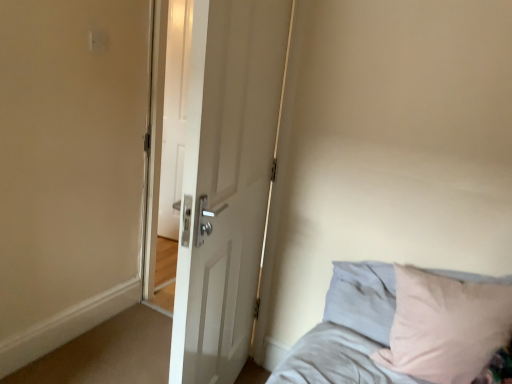
This screenshot has height=384, width=512. What do you see at coordinates (226, 182) in the screenshot? I see `white matte door at center` at bounding box center [226, 182].

This screenshot has height=384, width=512. Find the location of `white matte door at center`. white matte door at center is located at coordinates (226, 182).

What is the approximate width of light gray fabric bed at lower right?

26.66 inches.

This screenshot has width=512, height=384. I want to click on light gray fabric bed at lower right, so click(x=348, y=330).

What do you see at coordinates (348, 330) in the screenshot?
I see `light gray fabric bed at lower right` at bounding box center [348, 330].

This screenshot has width=512, height=384. What are the coordinates of `white matte door at center` in the screenshot? It's located at (226, 182).

Which object is positioned more to the right, white matte door at center or light gray fabric bed at lower right?

light gray fabric bed at lower right.

Relative to light gray fabric bed at lower right, is white matte door at center in front or behind?

Clearly, white matte door at center is in front of light gray fabric bed at lower right.

Between point (224, 332) and point (341, 301), which one is positioned in front?

The point (341, 301) is closer to the camera.

From the image's perspective, is white matte door at center positioned above or below light gray fabric bed at lower right?

white matte door at center is above light gray fabric bed at lower right.

From a real-world perspective, between white matte door at center and light gray fabric bed at lower right, who is vertically higher?

white matte door at center.

Which of these two, white matte door at center or light gray fabric bed at lower right, is wider?

With larger width is light gray fabric bed at lower right.

Considering the sizes of white matte door at center and light gray fabric bed at lower right in the image, is white matte door at center taller or shorter than light gray fabric bed at lower right?

Considering their sizes, white matte door at center has more height than light gray fabric bed at lower right.

Based on the photo, can you confirm if white matte door at center is smaller than light gray fabric bed at lower right?

Incorrect, white matte door at center is not smaller in size than light gray fabric bed at lower right.

Is white matte door at center positioned beyond the bounds of light gray fabric bed at lower right?

Absolutely, white matte door at center is external to light gray fabric bed at lower right.

Is there a large distance between white matte door at center and light gray fabric bed at lower right?

No.

Is white matte door at center oriented towards light gray fabric bed at lower right?

Yes, white matte door at center is oriented towards light gray fabric bed at lower right.

Measure the distance between white matte door at center and light gray fabric bed at lower right.

white matte door at center and light gray fabric bed at lower right are 22.44 inches apart.

Locate an element on the screen. This screenshot has width=512, height=384. door in front of the light gray fabric bed at lower right is located at coordinates (226, 182).

Visually, is light gray fabric bed at lower right positioned to the left or to the right of white matte door at center?

light gray fabric bed at lower right is positioned on white matte door at center's right side.

Considering the relative positions of light gray fabric bed at lower right and white matte door at center in the image provided, is light gray fabric bed at lower right behind white matte door at center?

Yes, light gray fabric bed at lower right is behind white matte door at center.

Considering the points (333, 341) and (223, 61), which point is in front, point (333, 341) or point (223, 61)?

The point (223, 61) is closer.

From the image's perspective, would you say light gray fabric bed at lower right is shown under white matte door at center?

Correct, light gray fabric bed at lower right appears lower than white matte door at center in the image.

From a real-world perspective, who is located lower, light gray fabric bed at lower right or white matte door at center?

From a 3D spatial view, light gray fabric bed at lower right is below.

Between light gray fabric bed at lower right and white matte door at center, which one has smaller width?

Thinner between the two is white matte door at center.

Considering the sizes of light gray fabric bed at lower right and white matte door at center in the image, is light gray fabric bed at lower right taller or shorter than white matte door at center?

Considering their sizes, light gray fabric bed at lower right has less height than white matte door at center.

Which of these two, light gray fabric bed at lower right or white matte door at center, is smaller?

With smaller size is light gray fabric bed at lower right.

Would you say white matte door at center is part of light gray fabric bed at lower right's contents?

Actually, white matte door at center is outside light gray fabric bed at lower right.

Are light gray fabric bed at lower right and white matte door at center located far from each other?

light gray fabric bed at lower right is actually quite close to white matte door at center.

Is light gray fabric bed at lower right oriented towards white matte door at center?

No, light gray fabric bed at lower right is not facing towards white matte door at center.

Locate an element on the screen. The height and width of the screenshot is (384, 512). door above the light gray fabric bed at lower right (from a real-world perspective) is located at coordinates (226, 182).

Where is `bed on the right of the white matte door at center`? bed on the right of the white matte door at center is located at coordinates (348, 330).

Where is `door above the light gray fabric bed at lower right (from the image's perspective)`? Image resolution: width=512 pixels, height=384 pixels. door above the light gray fabric bed at lower right (from the image's perspective) is located at coordinates (226, 182).